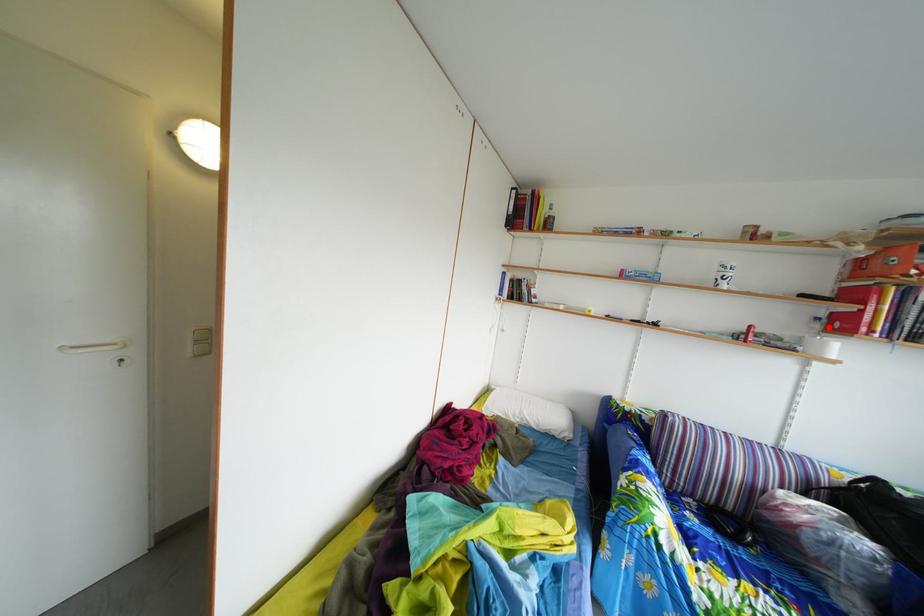
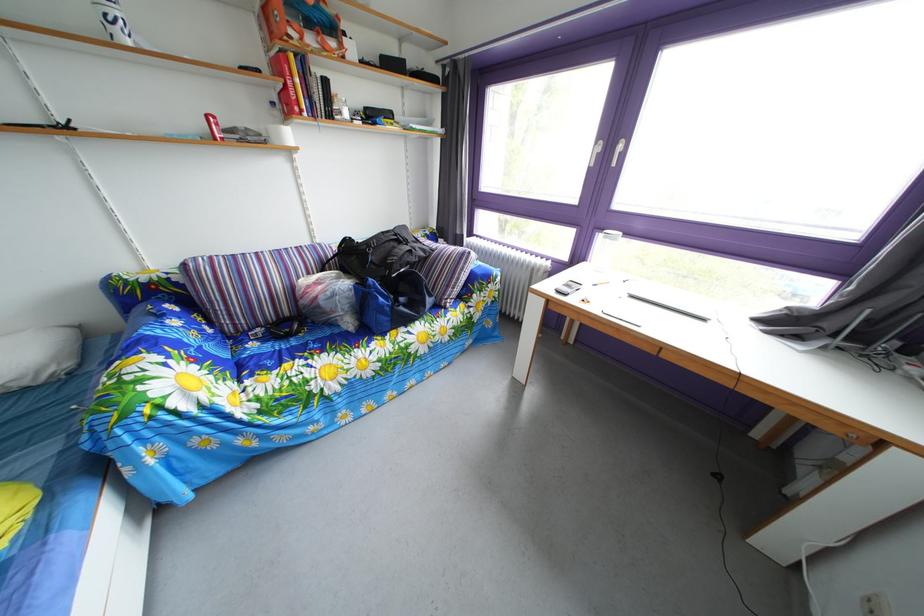
Find the pixel in the second image that matches the highlighted location in the first image.

(284, 111)